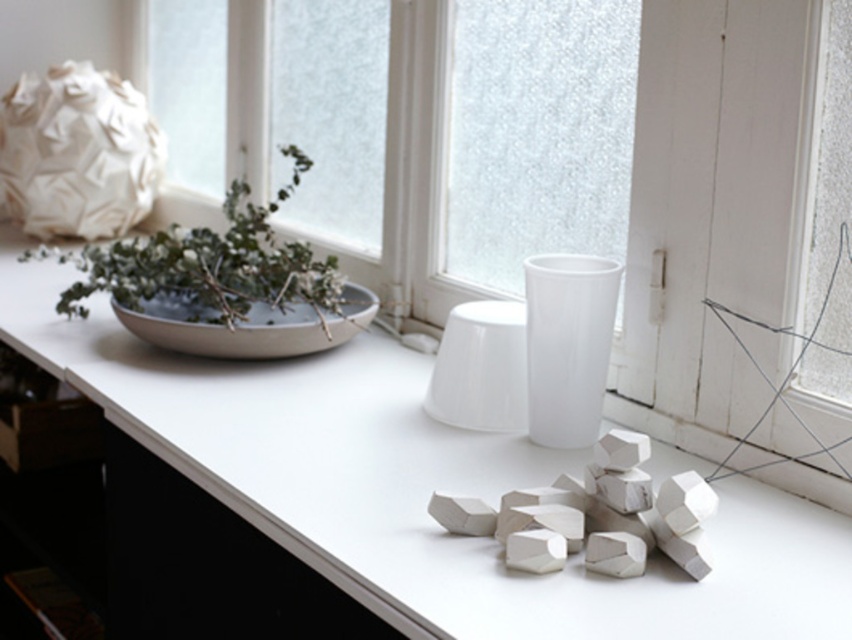
Question: Among these objects, which one is farthest from the camera?

Choices:
 (A) transparent glass window at upper center
 (B) green leafy plant at upper left
 (C) transparent glass window at center

Answer: (B)

Question: Is transparent glass window at center positioned at the back of green leafy plant at upper left?

Choices:
 (A) no
 (B) yes

Answer: (A)

Question: Does white matte counter top at center have a smaller size compared to green leafy plant at upper left?

Choices:
 (A) yes
 (B) no

Answer: (B)

Question: Does transparent glass window at center appear under white matte vase at center?

Choices:
 (A) yes
 (B) no

Answer: (B)

Question: Among these points, which one is farthest from the camera?

Choices:
 (A) (648, 628)
 (B) (171, 312)
 (C) (579, 234)
 (D) (553, 205)

Answer: (B)

Question: Which point appears farthest from the camera in this image?

Choices:
 (A) (596, 410)
 (B) (453, 22)
 (C) (122, 320)

Answer: (B)